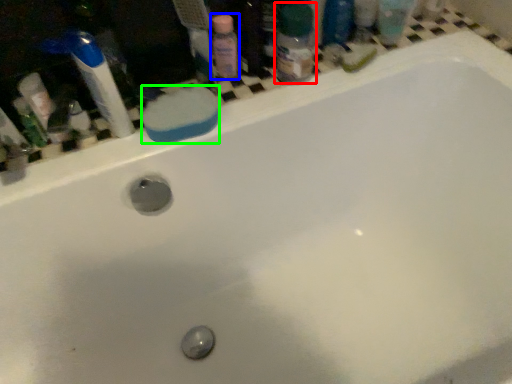
Question: Considering the real-world distances, which object is farthest from toiletry (highlighted by a red box)? cleaning product (highlighted by a blue box) or soap (highlighted by a green box)?

Choices:
 (A) cleaning product
 (B) soap

Answer: (B)